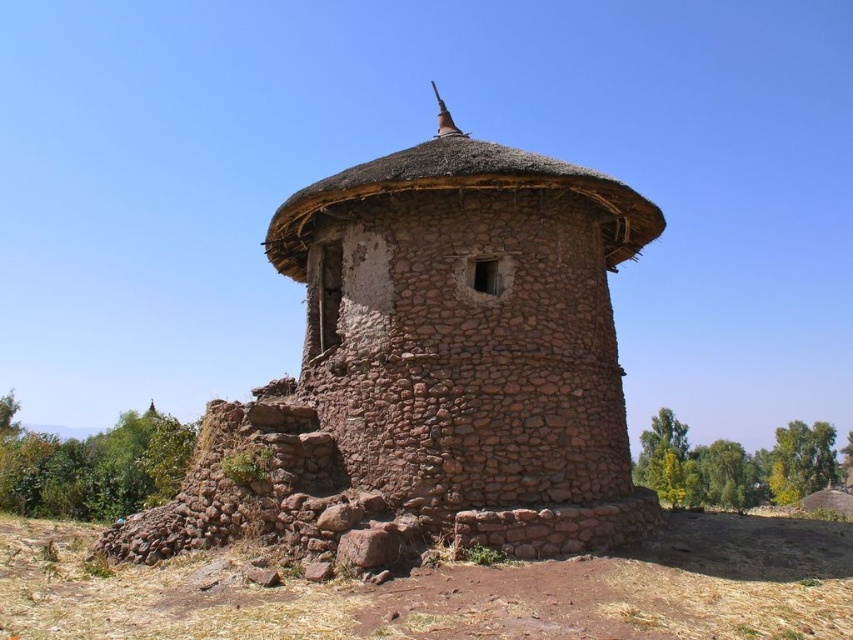
Question: Does brown stone tower at center appear under thatched straw roof at center?

Choices:
 (A) no
 (B) yes

Answer: (A)

Question: Which object is farther from the camera taking this photo?

Choices:
 (A) thatched straw roof at center
 (B) brown stone tower at center

Answer: (A)

Question: Among these points, which one is nearest to the camera?

Choices:
 (A) pyautogui.click(x=363, y=260)
 (B) pyautogui.click(x=444, y=180)

Answer: (B)

Question: Does brown stone tower at center have a greater width compared to thatched straw roof at center?

Choices:
 (A) yes
 (B) no

Answer: (B)

Question: Can you confirm if brown stone tower at center is positioned to the left of thatched straw roof at center?

Choices:
 (A) no
 (B) yes

Answer: (A)

Question: Which of the following is the farthest from the observer?

Choices:
 (A) thatched straw roof at center
 (B) brown stone tower at center

Answer: (A)